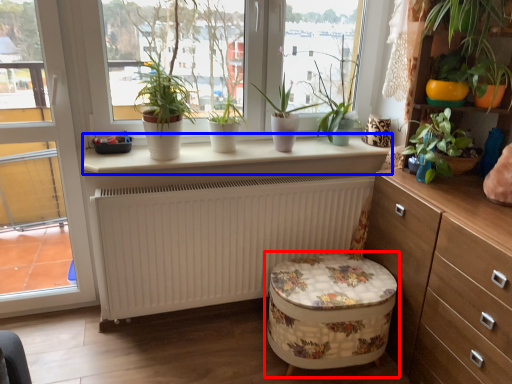
Question: Which object is further to the camera taking this photo, swivel chair (highlighted by a red box) or window sill (highlighted by a blue box)?

Choices:
 (A) swivel chair
 (B) window sill

Answer: (B)